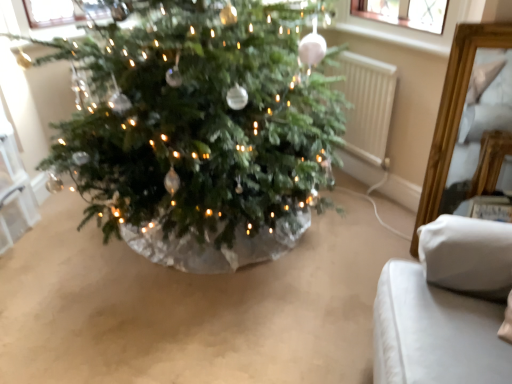
You are a GUI agent. You are given a task and a screenshot of the screen. Output one action in this format:
    pyautogui.click(x=<x>, y=<y>)
    Task: Click on the vacant space in white plastic radiator at center right (from a real-world perspective)
    Image resolution: width=512 pixels, height=384 pixels.
    Given the screenshot: What is the action you would take?
    pyautogui.click(x=351, y=178)